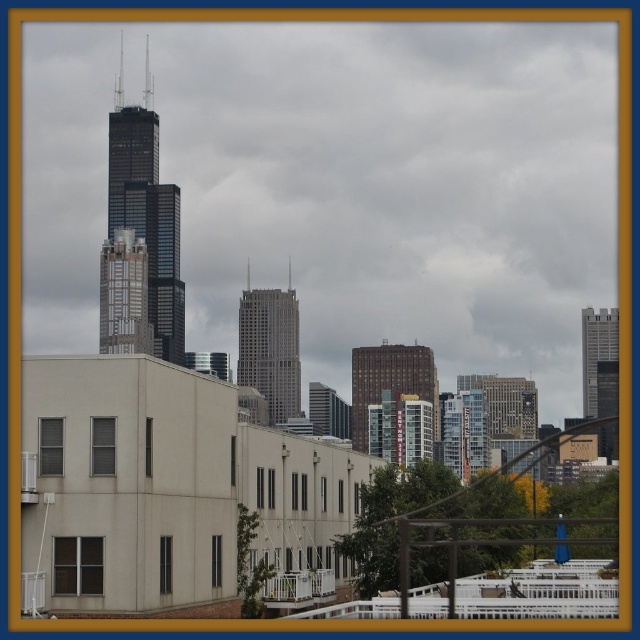
Who is more forward, (118, 230) or (413, 348)?

Point (413, 348)

This screenshot has height=640, width=640. I want to click on brown textured building at center, so click(124, 294).

Which of these two, black glass skyscraper at center or brown textured building at center, stands shorter?

With less height is brown textured building at center.

Is point (104, 328) more distant than point (99, 280)?

No.

Which is in front, point (168, 324) or point (106, 275)?

Point (168, 324) is in front.

Locate an element on the screen. The width and height of the screenshot is (640, 640). black glass skyscraper at center is located at coordinates (140, 237).

Does black glass skyscraper at center have a lesser width compared to gray glass skyscraper at center?

In fact, black glass skyscraper at center might be wider than gray glass skyscraper at center.

Which is more to the left, black glass skyscraper at center or gray glass skyscraper at center?

Positioned to the left is black glass skyscraper at center.

Describe the element at coordinates (140, 237) in the screenshot. The width and height of the screenshot is (640, 640). I see `black glass skyscraper at center` at that location.

The height and width of the screenshot is (640, 640). Find the location of `black glass skyscraper at center`. black glass skyscraper at center is located at coordinates (140, 237).